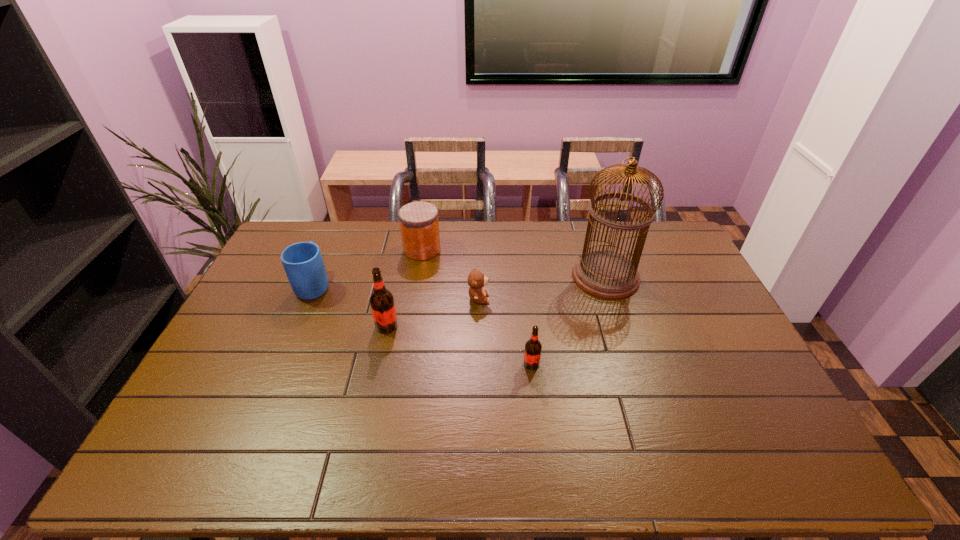
In order to click on free point that satisfies the following two spatial constraints: 1. on the back side of the second tallest object; 2. on the right side of the jar in this screenshot , I will do `click(403, 249)`.

Find the location of `vacant area that satisfies the following two spatial constraints: 1. on the face of the teddy bear; 2. on the front side of the left root beer`. vacant area that satisfies the following two spatial constraints: 1. on the face of the teddy bear; 2. on the front side of the left root beer is located at coordinates (478, 326).